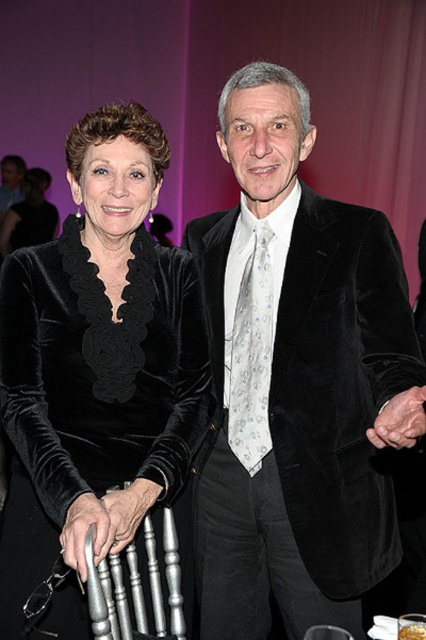
You are standing at point (x=245, y=230) and want to shake hands with the person on the right. The average human arm length is 0.7 meters. Can you reach them without moving?

The two individuals are 1.82 meters apart. Since the average human arm length is 0.7 meters, you cannot reach the person on the right from point (x=245, y=230) without moving closer.

You are at a formal event and see two people wearing velvet attire. The velvet black suit at center and the velvet black dress at center. Which one is positioned to the right of the other?

The velvet black suit at center is to the right of the velvet black dress at center.